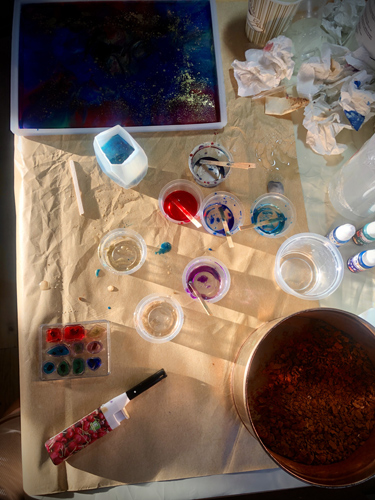
Locate an element on the screen. This screenshot has height=500, width=375. table is located at coordinates (162, 487).